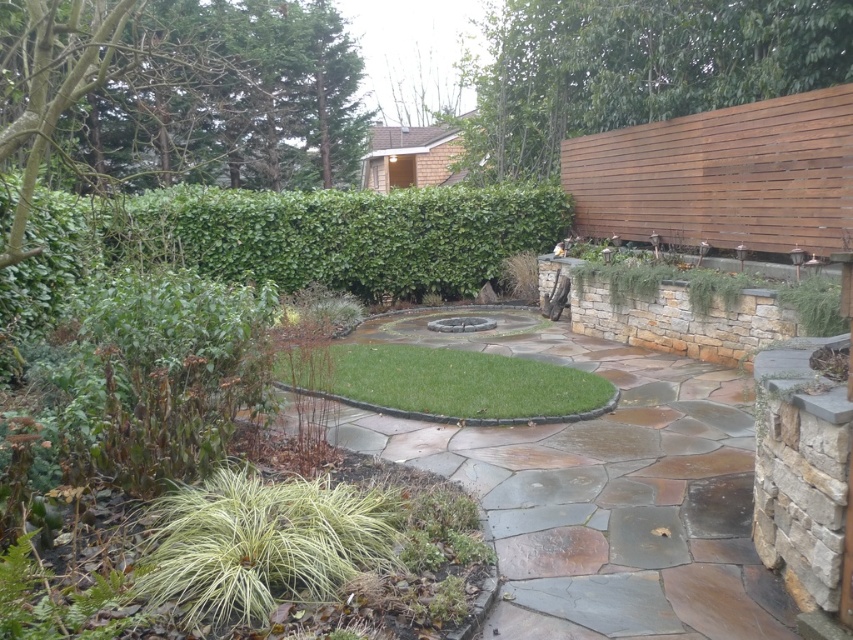
Which is below, green stone path at center or green grass at center?

Positioned lower is green stone path at center.

Who is shorter, green stone path at center or green grass at center?

With less height is green stone path at center.

Who is more forward, (596, 349) or (416, 387)?

Answer: Point (416, 387) is more forward.

Locate an element on the screen. green stone path at center is located at coordinates (601, 490).

Is point (498, 314) in front of point (508, 248)?

Yes, point (498, 314) is closer to viewer.

Does point (601, 506) lie in front of point (529, 198)?

Yes, it is.

You are a GUI agent. You are given a task and a screenshot of the screen. Output one action in this format:
    pyautogui.click(x=<x>, y=<y>)
    Task: Click on the green stone path at center
    The height and width of the screenshot is (640, 853).
    Given the screenshot: What is the action you would take?
    pyautogui.click(x=601, y=490)

Can you confirm if green grass at lower left is positioned above green grass at center?

Actually, green grass at lower left is below green grass at center.

Who is shorter, green grass at lower left or green grass at center?

green grass at lower left is shorter.

Is point (233, 541) less distant than point (358, 360)?

Yes, it is in front of point (358, 360).

The image size is (853, 640). Identify the location of green grass at lower left. 263,545.